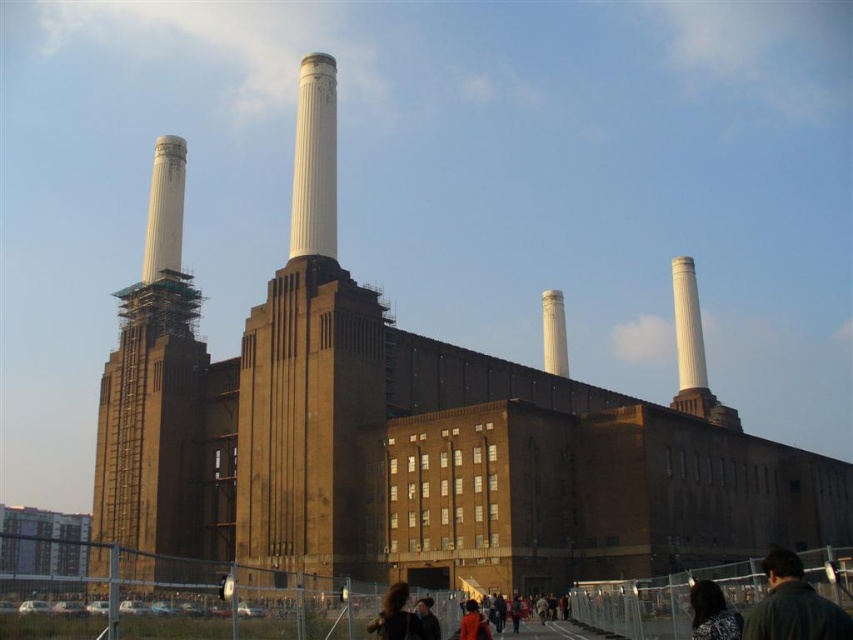
Is point (347, 636) positioned before point (778, 561)?

No, it is behind (778, 561).

Is green grass at lower center further to the viewer compared to dark brown leather jacket at lower right?

Yes, it is.

Is point (300, 616) in front of point (778, 595)?

That is False.

Locate an element on the screen. green grass at lower center is located at coordinates (166, 624).

Based on the photo, between patterned fabric headscarf at lower right and dark brown leather jacket at center, which one has less height?

Standing shorter between the two is dark brown leather jacket at center.

Is patterned fabric headscarf at lower right shorter than dark brown leather jacket at center?

No, patterned fabric headscarf at lower right is not shorter than dark brown leather jacket at center.

Who is more distant from viewer, (730, 621) or (424, 624)?

Point (424, 624)

This screenshot has height=640, width=853. I want to click on patterned fabric headscarf at lower right, so 712,612.

Consider the image. Is curly brown hair at center closer to the viewer compared to dark brown leather jacket at center?

Yes.

Does point (405, 636) lie behind point (434, 618)?

That is False.

Where is `curly brown hair at center`? Image resolution: width=853 pixels, height=640 pixels. curly brown hair at center is located at coordinates (396, 616).

This screenshot has width=853, height=640. What are the coordinates of `curly brown hair at center` in the screenshot? It's located at (396, 616).